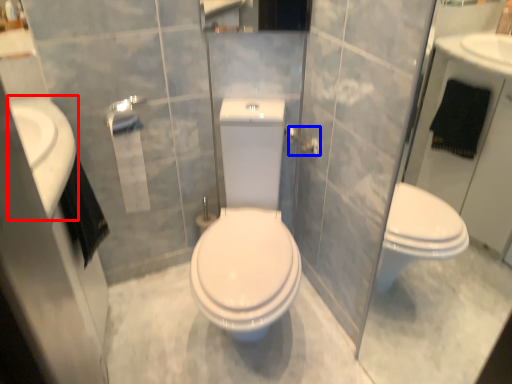
Question: Which of the following is the closest to the observer, sink (highlighted by a red box) or towel bar (highlighted by a blue box)?

Choices:
 (A) sink
 (B) towel bar

Answer: (A)